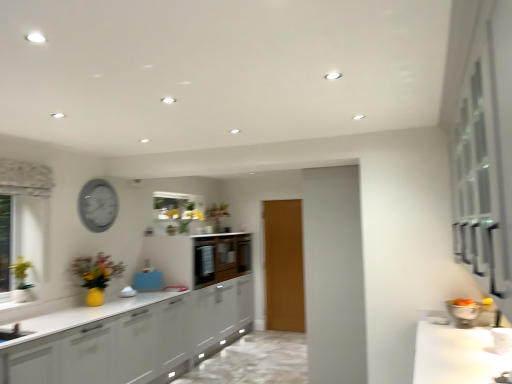
Question: Considering the relative positions of white glossy countertop at lower right and wooden door at center in the image provided, is white glossy countertop at lower right to the left of wooden door at center from the viewer's perspective?

Choices:
 (A) yes
 (B) no

Answer: (B)

Question: Is wooden door at center inside white glossy countertop at lower right?

Choices:
 (A) no
 (B) yes

Answer: (A)

Question: Is white glossy countertop at lower right taller than wooden door at center?

Choices:
 (A) no
 (B) yes

Answer: (A)

Question: Is white glossy countertop at lower right positioned before wooden door at center?

Choices:
 (A) yes
 (B) no

Answer: (A)

Question: Is white glossy countertop at lower right facing away from wooden door at center?

Choices:
 (A) yes
 (B) no

Answer: (B)

Question: Is white glossy countertop at lower right oriented towards wooden door at center?

Choices:
 (A) no
 (B) yes

Answer: (A)

Question: Is the position of yellow matte vase at left less distant than that of wooden door at center?

Choices:
 (A) yes
 (B) no

Answer: (A)

Question: Considering the relative positions of yellow matte vase at left and wooden door at center in the image provided, is yellow matte vase at left to the right of wooden door at center from the viewer's perspective?

Choices:
 (A) no
 (B) yes

Answer: (A)

Question: Considering the relative sizes of yellow matte vase at left and wooden door at center in the image provided, is yellow matte vase at left thinner than wooden door at center?

Choices:
 (A) yes
 (B) no

Answer: (B)

Question: Is yellow matte vase at left shorter than wooden door at center?

Choices:
 (A) yes
 (B) no

Answer: (A)

Question: From a real-world perspective, is yellow matte vase at left below wooden door at center?

Choices:
 (A) no
 (B) yes

Answer: (A)

Question: Does yellow matte vase at left have a larger size compared to wooden door at center?

Choices:
 (A) no
 (B) yes

Answer: (A)

Question: Does white glossy countertop at lower right appear on the right side of matte gray clock at upper left?

Choices:
 (A) yes
 (B) no

Answer: (A)